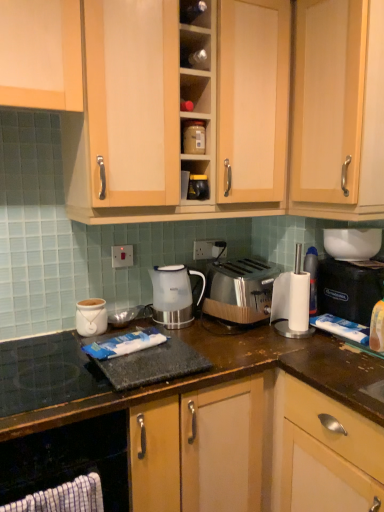
Question: From a real-world perspective, does black glass gas stove at lower left stand above white plastic electric outlet at center?

Choices:
 (A) yes
 (B) no

Answer: (B)

Question: From the image's perspective, is black glass gas stove at lower left on white plastic electric outlet at center?

Choices:
 (A) yes
 (B) no

Answer: (B)

Question: Would you consider black glass gas stove at lower left to be distant from white plastic electric outlet at center?

Choices:
 (A) no
 (B) yes

Answer: (A)

Question: Is the position of black glass gas stove at lower left less distant than that of white plastic electric outlet at center?

Choices:
 (A) yes
 (B) no

Answer: (A)

Question: Is black glass gas stove at lower left positioned behind white plastic electric outlet at center?

Choices:
 (A) no
 (B) yes

Answer: (A)

Question: Is point (59, 483) closer or farther from the camera than point (127, 492)?

Choices:
 (A) farther
 (B) closer

Answer: (B)

Question: Do you think black rubber mat at lower left is within wooden cabinet at lower center, the 1th cabinetry from the bottom, or outside of it?

Choices:
 (A) outside
 (B) inside

Answer: (B)

Question: Looking at the image, does black rubber mat at lower left seem bigger or smaller compared to wooden cabinet at lower center, the third cabinetry viewed from the top?

Choices:
 (A) big
 (B) small

Answer: (B)

Question: Would you say black rubber mat at lower left is to the left or to the right of wooden cabinet at lower center, the 1th cabinetry from the bottom, in the picture?

Choices:
 (A) right
 (B) left

Answer: (B)

Question: From the image's perspective, is light wood cabinet at upper center, which is the third cabinetry from bottom to top, above or below black rubber mat at lower left?

Choices:
 (A) above
 (B) below

Answer: (A)

Question: Is light wood cabinet at upper center, which is the first cabinetry from top to bottom, to the left or to the right of black rubber mat at lower left in the image?

Choices:
 (A) right
 (B) left

Answer: (A)

Question: Considering the positions of point (233, 71) and point (112, 489), is point (233, 71) closer or farther from the camera than point (112, 489)?

Choices:
 (A) farther
 (B) closer

Answer: (A)

Question: In terms of height, does light wood cabinet at upper center, which is the third cabinetry from bottom to top, look taller or shorter compared to black rubber mat at lower left?

Choices:
 (A) tall
 (B) short

Answer: (A)

Question: Is satin silver toaster at center inside the boundaries of white glossy bowl at upper right, the 4th appliance from the left, or outside?

Choices:
 (A) outside
 (B) inside

Answer: (A)

Question: From a real-world perspective, is satin silver toaster at center above or below white glossy bowl at upper right, the third appliance viewed from the top?

Choices:
 (A) above
 (B) below

Answer: (B)